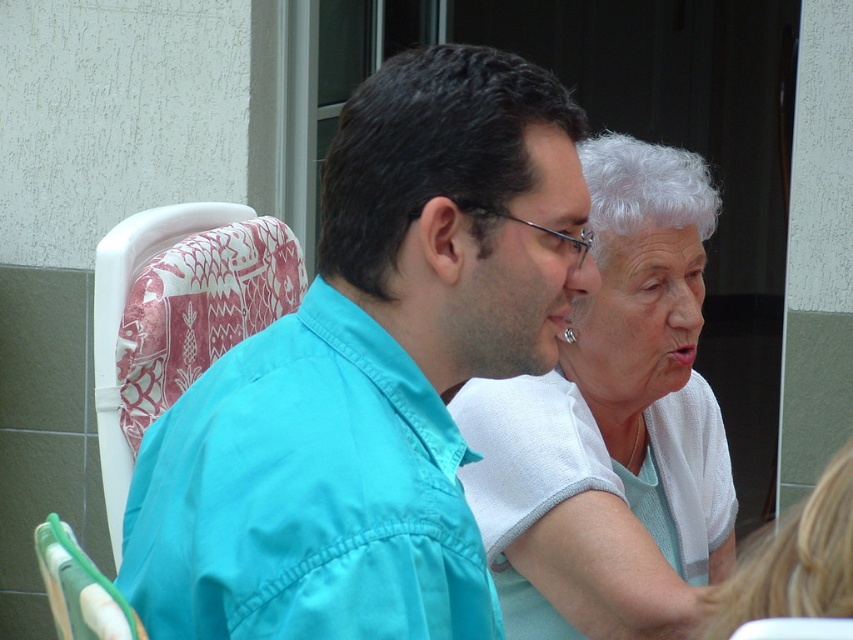
Who is positioned more to the right, white textured shirt at center or matte teal shirt at center?

Positioned to the right is white textured shirt at center.

In the scene shown: Can you confirm if white textured shirt at center is bigger than matte teal shirt at center?

Correct, white textured shirt at center is larger in size than matte teal shirt at center.

Image resolution: width=853 pixels, height=640 pixels. In order to click on white textured shirt at center in this screenshot , I will do `click(611, 426)`.

Which is more to the left, white textured shirt at center or white fabric at upper right?

white textured shirt at center

Which is in front, point (538, 486) or point (659, 308)?

Point (538, 486) is in front.

Between point (688, 284) and point (677, 358), which one is positioned in front?

Positioned in front is point (677, 358).

Identify the location of white textured shirt at center. Image resolution: width=853 pixels, height=640 pixels. (611, 426).

Which of these two, matte teal shirt at center or white fabric at upper right, stands shorter?

matte teal shirt at center

Between point (491, 344) and point (674, 328), which one is positioned behind?

The point (674, 328) is more distant.

What are the coordinates of `matte teal shirt at center` in the screenshot? It's located at (521, 266).